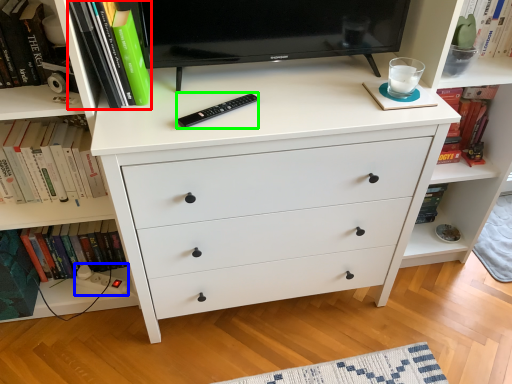
Question: Considering the real-world distances, which object is farthest from book (highlighted by a red box)? plug (highlighted by a blue box) or remote (highlighted by a green box)?

Choices:
 (A) plug
 (B) remote

Answer: (A)